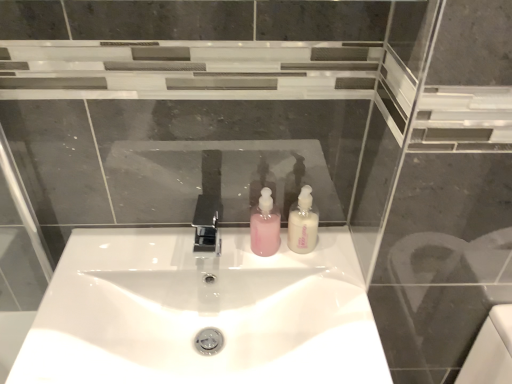
The image size is (512, 384). Find the location of `vacant area on top of white glossy sink at center (from a real-world perspective)`. vacant area on top of white glossy sink at center (from a real-world perspective) is located at coordinates (205, 268).